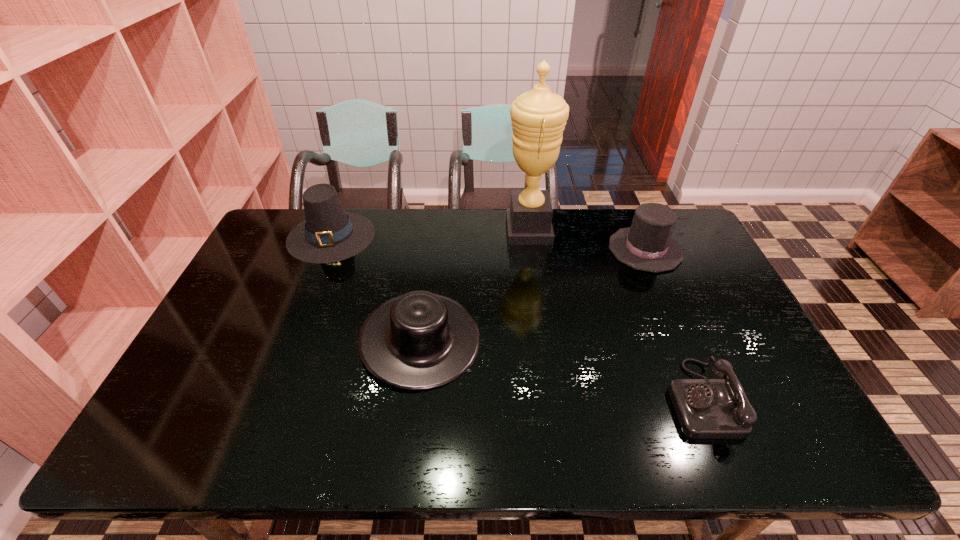
The image size is (960, 540). In order to click on empty location between the second tallest object and the telephone in this screenshot , I will do `click(516, 317)`.

This screenshot has height=540, width=960. I want to click on blank region between the telephone and the rightmost dress hat, so click(673, 324).

Identify the location of blank region between the telephone and the third object from left to right. (614, 314).

Identify the location of unoccupied area between the rightmost dress hat and the leftmost object. The image size is (960, 540). (488, 242).

Find the location of a particular element. vacant area that lies between the leftmost object and the trophy cup is located at coordinates (430, 233).

Find the location of a particular element. free space between the trophy cup and the telephone is located at coordinates (614, 314).

Find the location of a particular element. vacant area that lies between the trophy cup and the second dress hat from left to right is located at coordinates (474, 285).

Find the location of a particular element. This screenshot has height=540, width=960. free space between the second dress hat from left to right and the trophy cup is located at coordinates (474, 285).

Image resolution: width=960 pixels, height=540 pixels. I want to click on vacant area between the rightmost dress hat and the leftmost object, so click(x=488, y=242).

Locate an element on the screen. The image size is (960, 540). vacant point located between the telephone and the second dress hat from right to left is located at coordinates (561, 369).